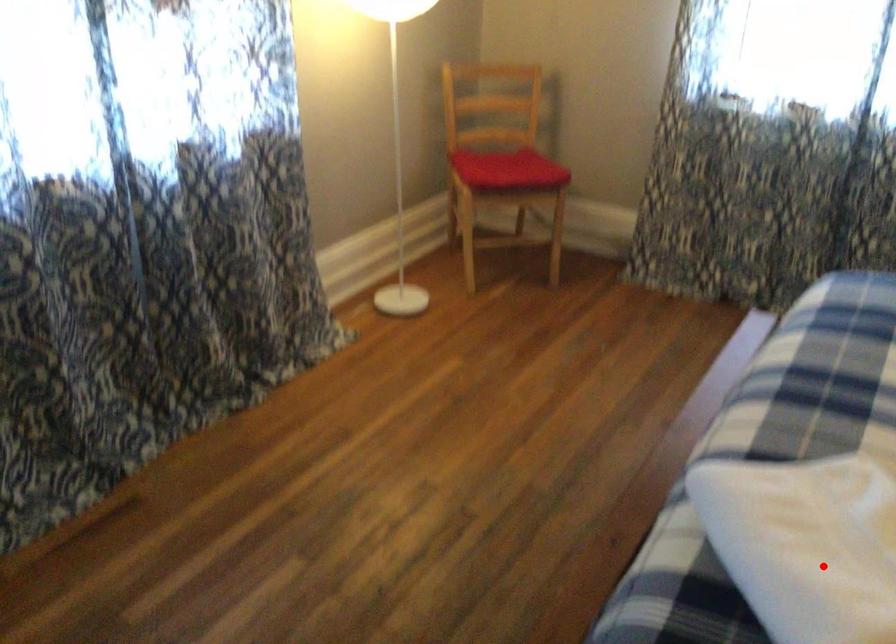
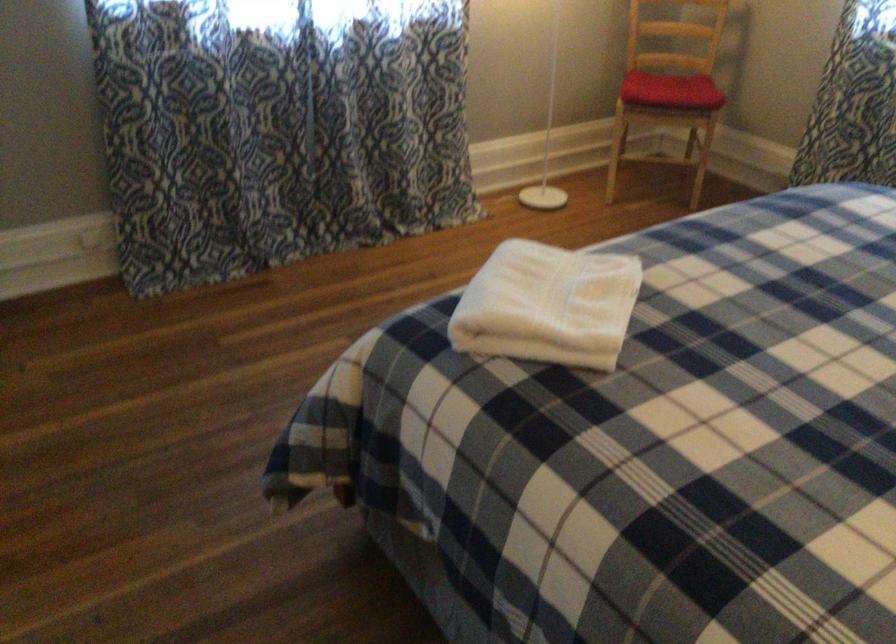
Where in the second image is the point corresponding to the highlighted location from the first image?

(547, 305)